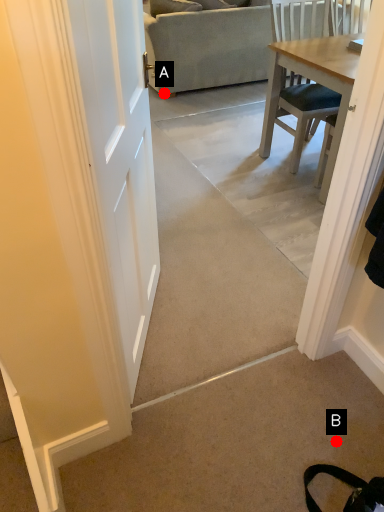
Question: Two points are circled on the image, labeled by A and B beside each circle. Which point appears farthest from the camera in this image?

Choices:
 (A) A is further
 (B) B is further

Answer: (A)